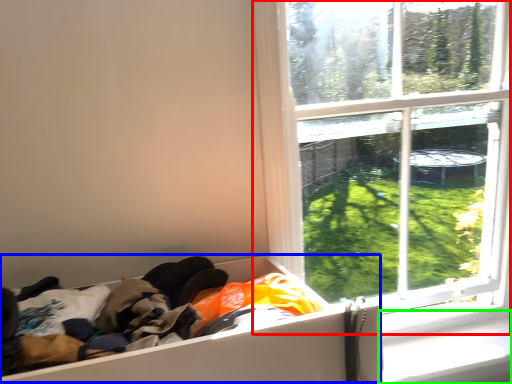
Question: Based on their relative distances, which object is nearer to window (highlighted by a red box)? Choose from storage box (highlighted by a blue box) and window sill (highlighted by a green box).

Choices:
 (A) storage box
 (B) window sill

Answer: (B)